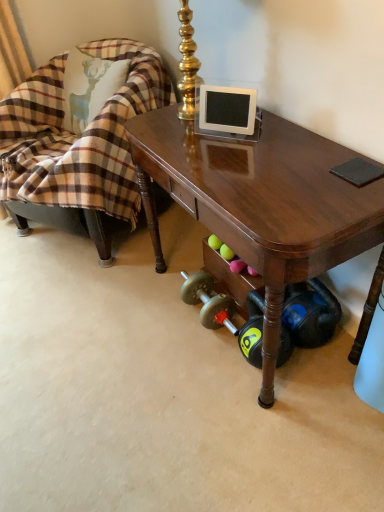
Question: Can we say shiny brown desk at center lies outside plaid fabric chair at left?

Choices:
 (A) no
 (B) yes

Answer: (B)

Question: Considering the relative sizes of shiny brown desk at center and plaid fabric chair at left in the image provided, is shiny brown desk at center shorter than plaid fabric chair at left?

Choices:
 (A) no
 (B) yes

Answer: (B)

Question: Does shiny brown desk at center have a smaller size compared to plaid fabric chair at left?

Choices:
 (A) no
 (B) yes

Answer: (B)

Question: From a real-world perspective, is shiny brown desk at center below plaid fabric chair at left?

Choices:
 (A) no
 (B) yes

Answer: (B)

Question: Can you confirm if shiny brown desk at center is taller than plaid fabric chair at left?

Choices:
 (A) yes
 (B) no

Answer: (B)

Question: Is shiny brown desk at center touching plaid fabric chair at left?

Choices:
 (A) yes
 (B) no

Answer: (B)

Question: Can you confirm if plaid fabric chair at left is wider than shiny brown desk at center?

Choices:
 (A) no
 (B) yes

Answer: (B)

Question: From a real-world perspective, is plaid fabric chair at left positioned over shiny brown desk at center based on gravity?

Choices:
 (A) no
 (B) yes

Answer: (B)

Question: Is the position of plaid fabric chair at left more distant than that of shiny brown desk at center?

Choices:
 (A) no
 (B) yes

Answer: (B)

Question: Is plaid fabric chair at left beside shiny brown desk at center?

Choices:
 (A) no
 (B) yes

Answer: (A)

Question: From the image's perspective, does plaid fabric chair at left appear higher than shiny brown desk at center?

Choices:
 (A) no
 (B) yes

Answer: (B)

Question: Can you confirm if plaid fabric chair at left is taller than shiny brown desk at center?

Choices:
 (A) no
 (B) yes

Answer: (B)

Question: Do you think shiny brown desk at center is within plaid fabric chair at left, or outside of it?

Choices:
 (A) inside
 (B) outside

Answer: (B)